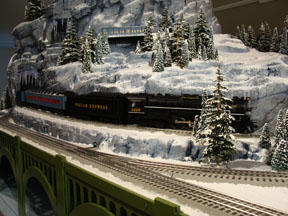
Find the location of `corners`. corners is located at coordinates (280, 212), (10, 210), (9, 16), (282, 5).